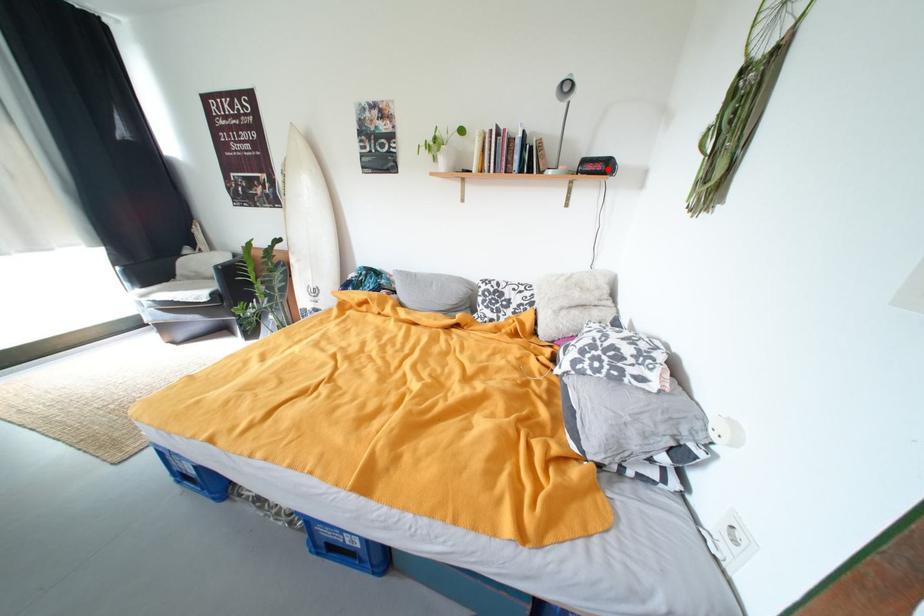
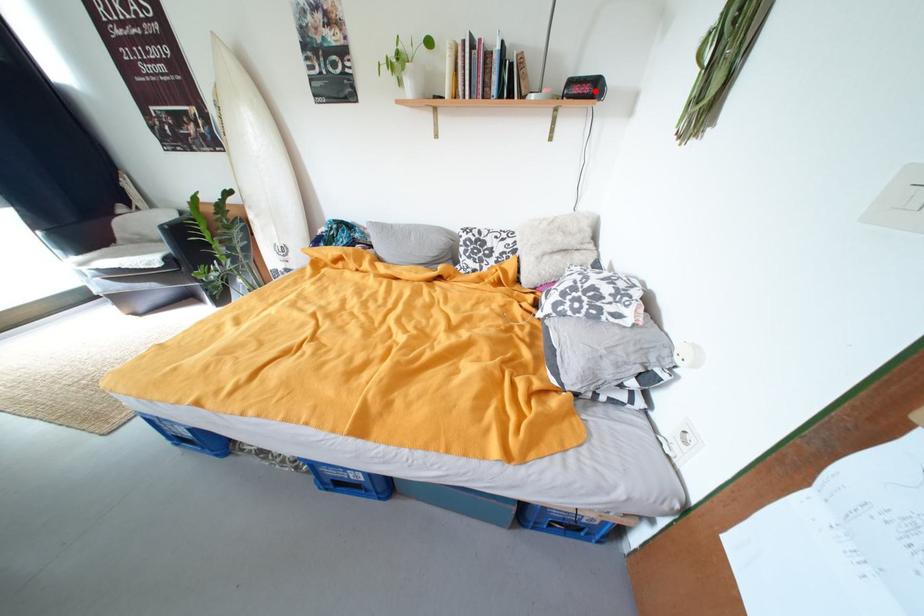
I am providing you with two images of the same scene from different viewpoints. A red point is marked on the first image and another point is marked on the second image. Do the highlighted points in image1 and image2 indicate the same real-world spot?

Yes